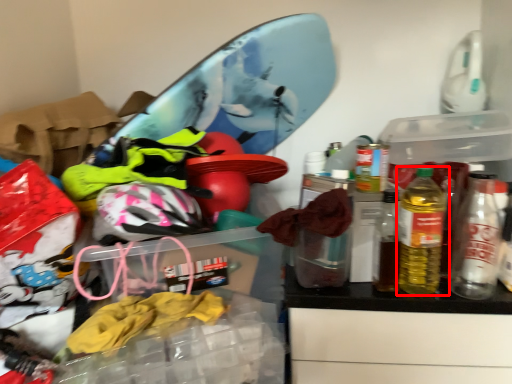
Question: From the image, what is the correct spatial relationship of bottle (annotated by the red box) in relation to bottle?

Choices:
 (A) left
 (B) right

Answer: (A)